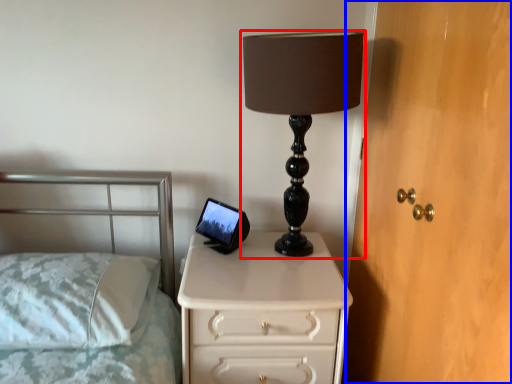
Question: Which point is closer to the camera, lamp (highlighted by a red box) or dresser (highlighted by a blue box)?

Choices:
 (A) lamp
 (B) dresser

Answer: (B)